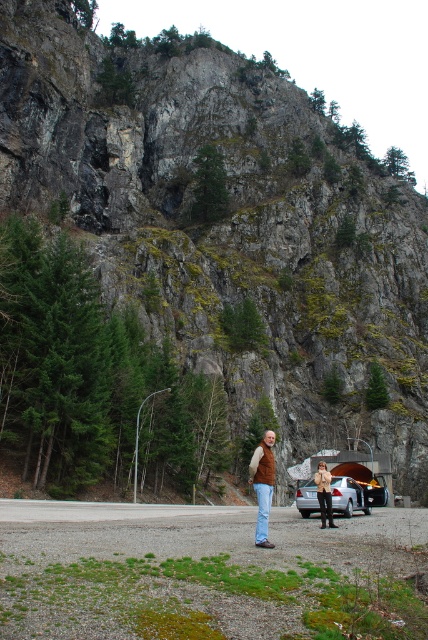
What do you see at coordinates (347, 497) in the screenshot? I see `satin silver sedan at center` at bounding box center [347, 497].

Which is in front, point (357, 508) or point (377, 486)?

Positioned in front is point (357, 508).

Locate an element on the screen. This screenshot has height=640, width=428. satin silver sedan at center is located at coordinates (347, 497).

I want to click on brown suede vest at center, so click(x=262, y=484).

Does brown suede vest at center appear under brown suede jacket at center?

Actually, brown suede vest at center is above brown suede jacket at center.

Between point (270, 468) and point (321, 461), which one is positioned behind?

Point (321, 461)

Image resolution: width=428 pixels, height=640 pixels. I want to click on brown suede vest at center, so click(x=262, y=484).

Image resolution: width=428 pixels, height=640 pixels. Identify the location of brown suede vest at center. (262, 484).

Does brown suede vest at center appear under metallic silver baby carriage at center?

Actually, brown suede vest at center is above metallic silver baby carriage at center.

Identify the location of brown suede vest at center. (262, 484).

Locate an element on the screen. The width and height of the screenshot is (428, 640). brown suede vest at center is located at coordinates (262, 484).